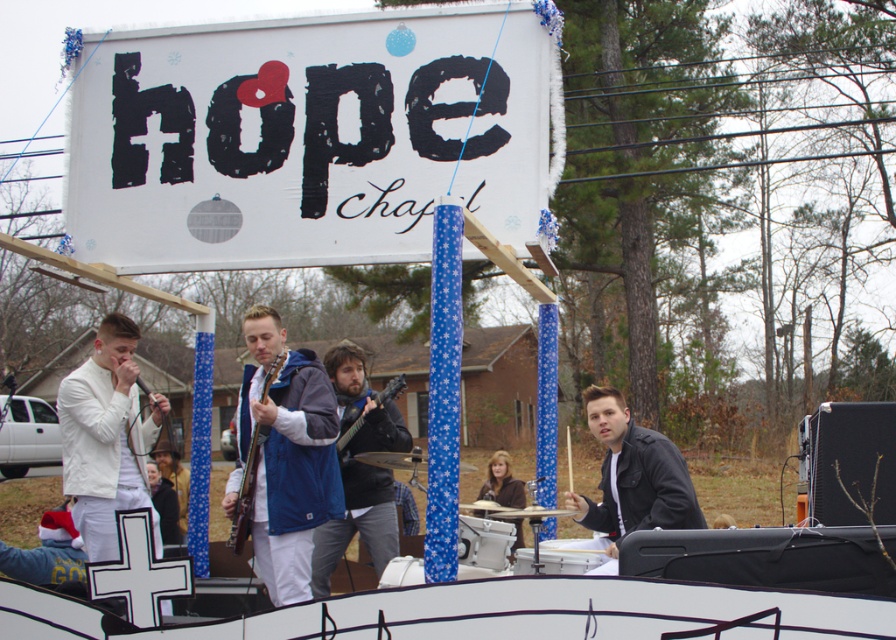
Who is lower down, dark brown leather jacket at center or black matte guitar at center?

dark brown leather jacket at center

Locate an element on the screen. dark brown leather jacket at center is located at coordinates (162, 502).

Is bearded man with guitar at center further to camera compared to black leather jacket at center?

Yes, it is.

Is point (324, 522) closer to camera compared to point (616, 509)?

Yes.

Describe the element at coordinates (359, 468) in the screenshot. This screenshot has width=896, height=640. I see `bearded man with guitar at center` at that location.

Where is `bearded man with guitar at center`? This screenshot has width=896, height=640. bearded man with guitar at center is located at coordinates (359, 468).

Who is higher up, brown fuzzy jacket at center or black matte guitar at center?

black matte guitar at center is higher up.

Does point (487, 486) lie in front of point (355, 422)?

No, it is behind (355, 422).

This screenshot has width=896, height=640. Identify the location of brown fuzzy jacket at center. (502, 483).